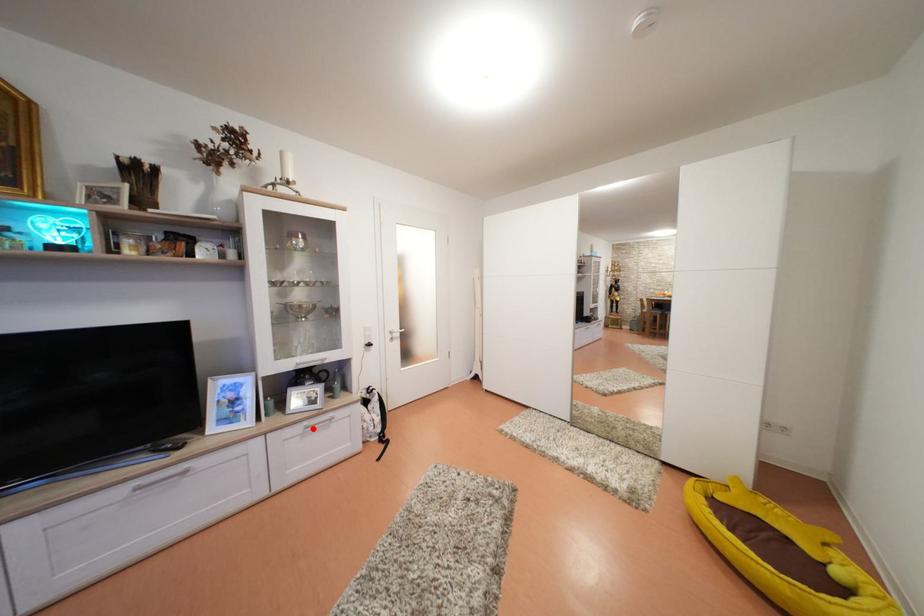
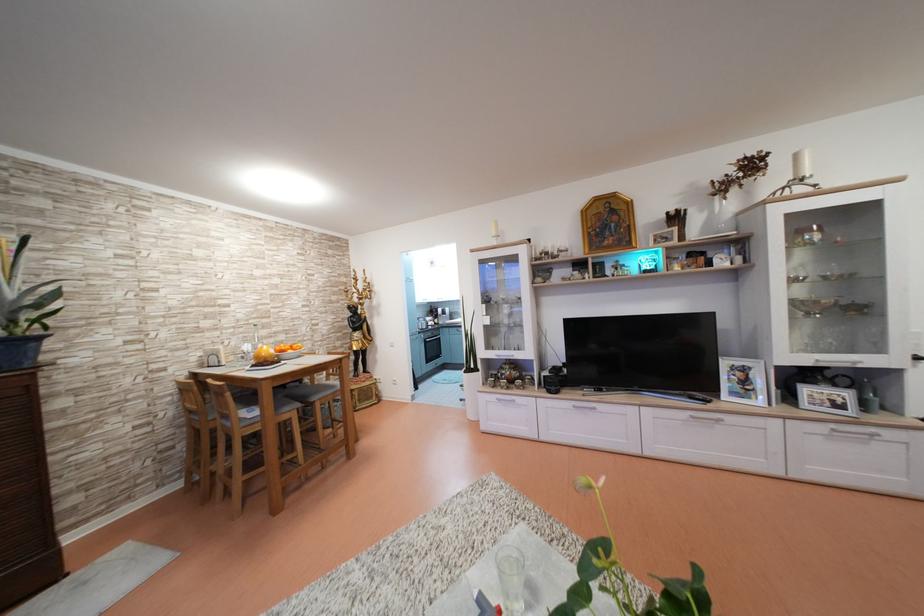
The point at the highlighted location is marked in the first image. Where is the corresponding point in the second image?

(840, 431)